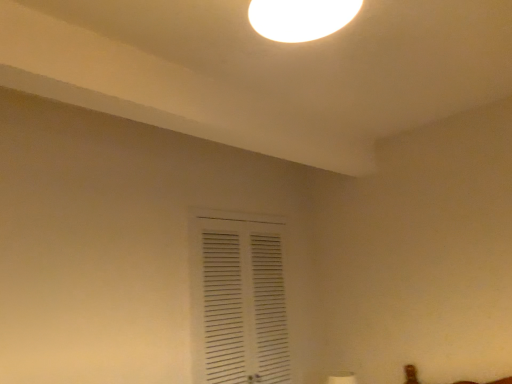
Question: Considering the positions of point (250, 11) and point (244, 334), is point (250, 11) closer or farther from the camera than point (244, 334)?

Choices:
 (A) farther
 (B) closer

Answer: (B)

Question: Considering their positions, is white glossy light fixture at upper center located in front of or behind white matte vent at center?

Choices:
 (A) behind
 (B) front

Answer: (B)

Question: Looking at their shapes, would you say white glossy light fixture at upper center is wider or thinner than white matte vent at center?

Choices:
 (A) thin
 (B) wide

Answer: (B)

Question: Relative to white glossy light fixture at upper center, is white matte vent at center in front or behind?

Choices:
 (A) behind
 (B) front

Answer: (A)

Question: Based on their sizes in the image, would you say white matte vent at center is bigger or smaller than white glossy light fixture at upper center?

Choices:
 (A) small
 (B) big

Answer: (B)

Question: Is white matte vent at center wider or thinner than white glossy light fixture at upper center?

Choices:
 (A) thin
 (B) wide

Answer: (A)

Question: From their relative heights in the image, would you say white matte vent at center is taller or shorter than white glossy light fixture at upper center?

Choices:
 (A) tall
 (B) short

Answer: (A)